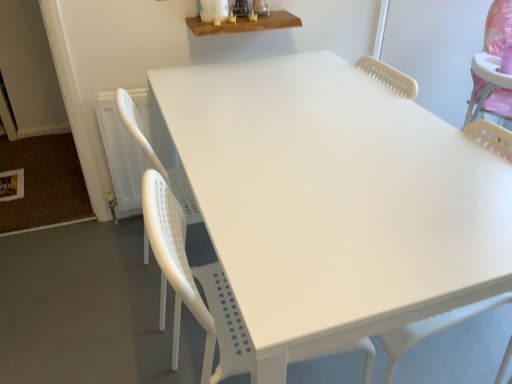
Question: Could you tell me if wooden shelf at upper center, positioned as the first table in top-to-bottom order, is turned towards white plastic table at center, the 1th table ordered from the bottom?

Choices:
 (A) yes
 (B) no

Answer: (B)

Question: Considering the relative sizes of wooden shelf at upper center, positioned as the first table in top-to-bottom order, and white plastic table at center, the 1th table ordered from the bottom, in the image provided, is wooden shelf at upper center, positioned as the first table in top-to-bottom order, taller than white plastic table at center, the 1th table ordered from the bottom,?

Choices:
 (A) no
 (B) yes

Answer: (A)

Question: Considering the relative sizes of wooden shelf at upper center, arranged as the 2th table when ordered from the bottom, and white plastic table at center, the second table in the top-to-bottom sequence, in the image provided, is wooden shelf at upper center, arranged as the 2th table when ordered from the bottom, shorter than white plastic table at center, the second table in the top-to-bottom sequence,?

Choices:
 (A) yes
 (B) no

Answer: (A)

Question: Is white plastic table at center, the 1th table ordered from the bottom, located within wooden shelf at upper center, arranged as the 2th table when ordered from the bottom?

Choices:
 (A) yes
 (B) no

Answer: (B)

Question: Is wooden shelf at upper center, positioned as the first table in top-to-bottom order, not near white plastic table at center, the 1th table ordered from the bottom?

Choices:
 (A) yes
 (B) no

Answer: (B)

Question: Is wooden shelf at upper center, arranged as the 2th table when ordered from the bottom, at the left side of white plastic table at center, the 1th table ordered from the bottom?

Choices:
 (A) yes
 (B) no

Answer: (B)

Question: Is white plastic table at center, the second table in the top-to-bottom sequence, far away from wooden shelf at upper center, positioned as the first table in top-to-bottom order?

Choices:
 (A) no
 (B) yes

Answer: (A)

Question: Is the depth of white plastic table at center, the second table in the top-to-bottom sequence, less than that of wooden shelf at upper center, arranged as the 2th table when ordered from the bottom?

Choices:
 (A) yes
 (B) no

Answer: (A)

Question: Is white plastic table at center, the 1th table ordered from the bottom, oriented towards wooden shelf at upper center, arranged as the 2th table when ordered from the bottom?

Choices:
 (A) no
 (B) yes

Answer: (A)

Question: Can you confirm if white plastic table at center, the second table in the top-to-bottom sequence, is positioned to the right of wooden shelf at upper center, arranged as the 2th table when ordered from the bottom?

Choices:
 (A) yes
 (B) no

Answer: (B)

Question: From the image's perspective, would you say white plastic table at center, the second table in the top-to-bottom sequence, is shown under wooden shelf at upper center, positioned as the first table in top-to-bottom order?

Choices:
 (A) yes
 (B) no

Answer: (A)

Question: Is white plastic table at center, the 1th table ordered from the bottom, facing away from wooden shelf at upper center, positioned as the first table in top-to-bottom order?

Choices:
 (A) no
 (B) yes

Answer: (A)

Question: Does white plastic table at center, the 1th table ordered from the bottom, come in front of white plastic swivel chair at center?

Choices:
 (A) no
 (B) yes

Answer: (A)